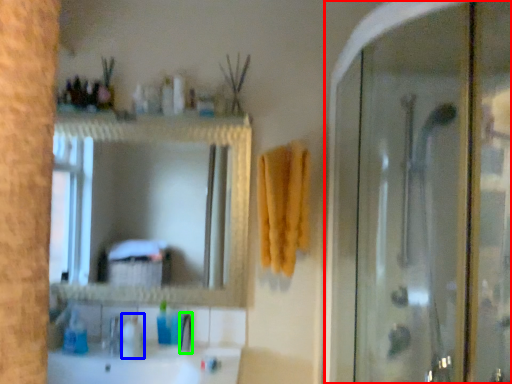
Question: Considering the real-world distances, which object is farthest from screen door (highlighted by a red box)? toiletry (highlighted by a blue box) or faucet (highlighted by a green box)?

Choices:
 (A) toiletry
 (B) faucet

Answer: (A)